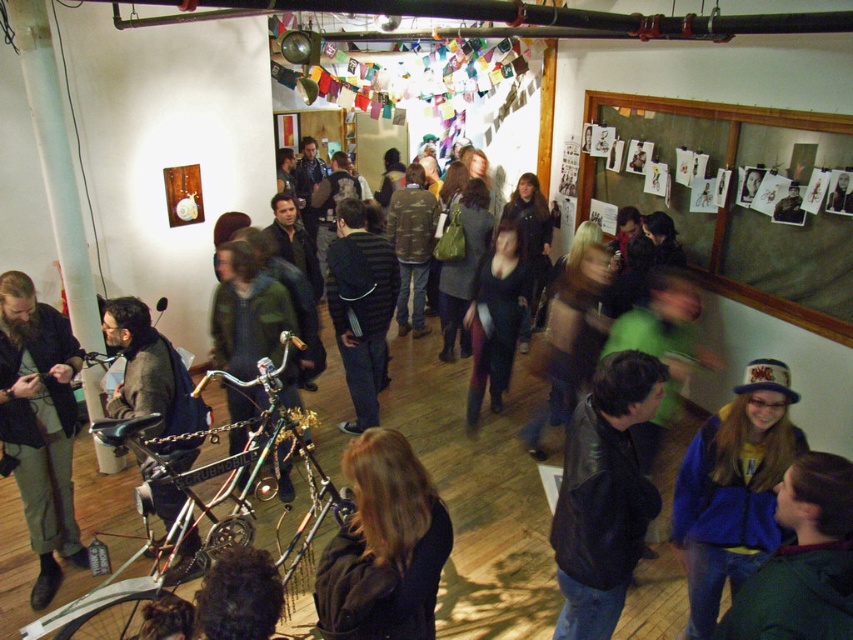
Question: Considering the real-world distances, which object is closest to the blue fuzzy jacket at lower right?

Choices:
 (A) white paper photos at upper right
 (B) dark brown leather jacket at center
 (C) shiny metallic bicycle at lower left
 (D) dark brown leather jacket at left

Answer: (B)

Question: Can you confirm if dark blue jacket at lower right is positioned to the left of matte black jacket at center?

Choices:
 (A) yes
 (B) no

Answer: (B)

Question: Which object is farther from the camera taking this photo?

Choices:
 (A) dark brown leather jacket at center
 (B) white paper photos at upper right

Answer: (B)

Question: Among these points, which one is nearest to the camera?

Choices:
 (A) (758, 307)
 (B) (491, 259)
 (C) (198, 547)
 (D) (654, 499)

Answer: (D)

Question: Is blue fuzzy jacket at lower right below dark brown leather jacket at left?

Choices:
 (A) no
 (B) yes

Answer: (B)

Question: Is dark blue jacket at lower right above striped sweater at center?

Choices:
 (A) no
 (B) yes

Answer: (A)